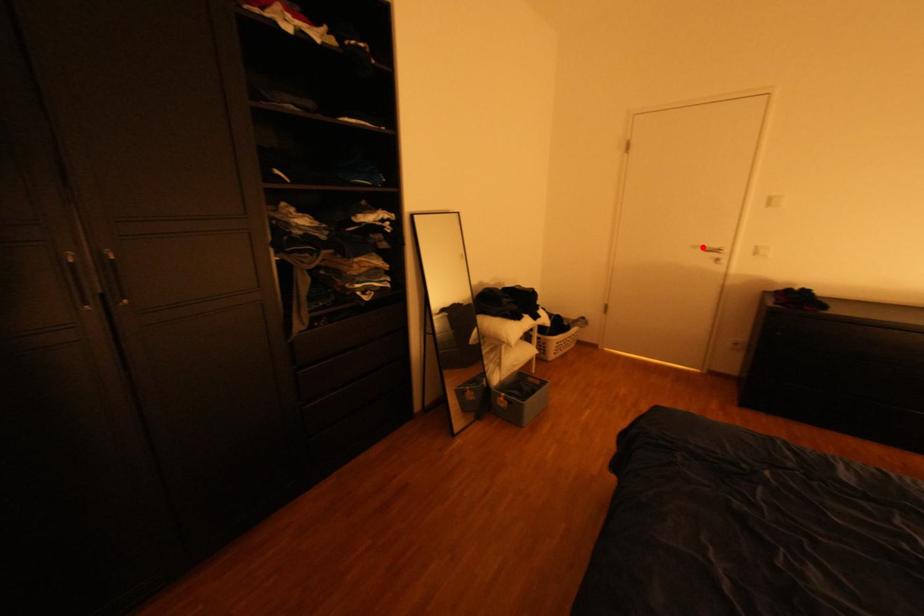
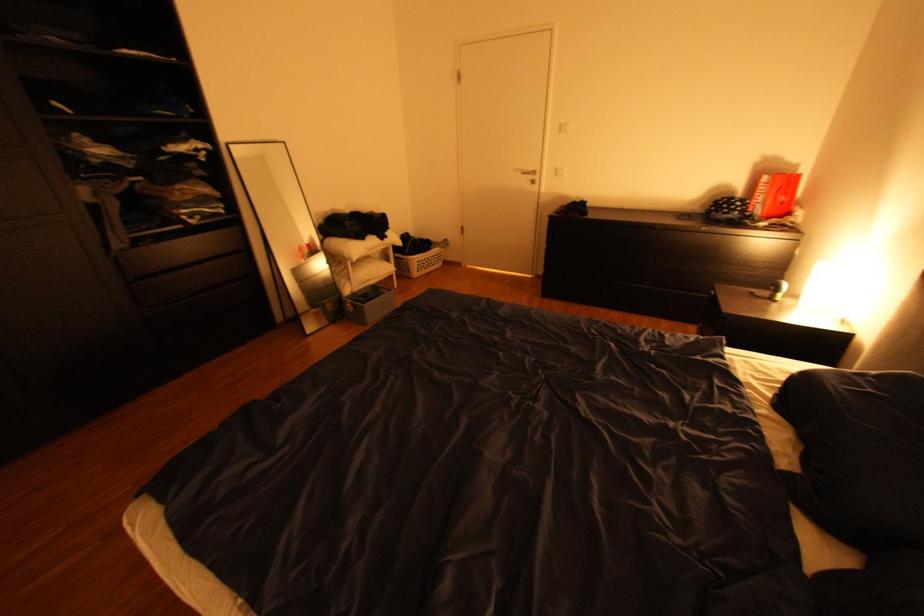
Locate, in the second image, the point that corresponds to the highlighted location in the first image.

(526, 171)